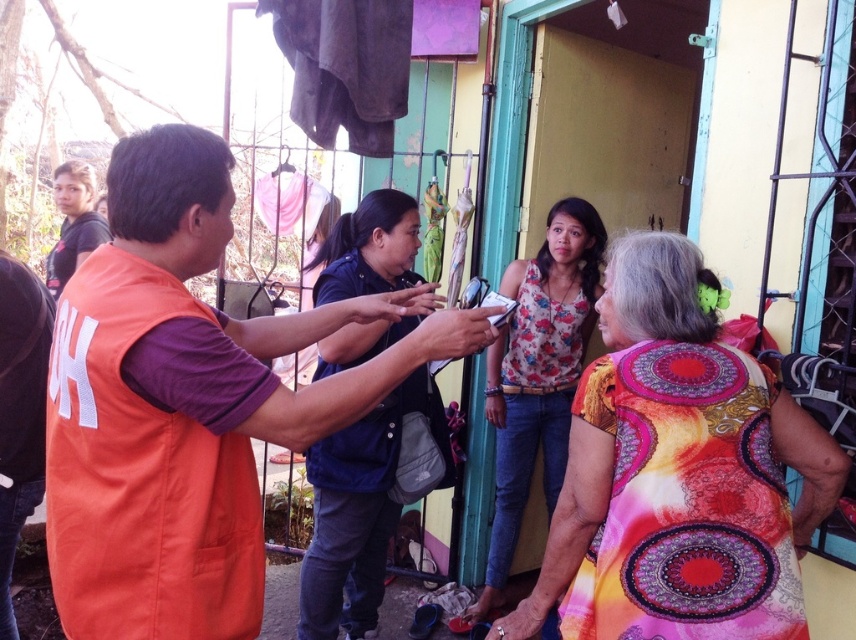
You are a painter who needs to paint a hand and a bracelet. You have brushes of different sizes. Which object requires a larger brush to paint accurately, the smooth skin hand at center or the smooth leather bracelet at lower center?

The smooth skin hand at center requires a larger brush because it is bigger than the smooth leather bracelet at lower center.

You are a photographer trying to capture a candid shot of the smooth skin hand at center and the floral fabric blouse at center. Which object should you focus on first if you want to ensure both are in focus?

The smooth skin hand at center is behind the floral fabric blouse at center, so you should focus on the floral fabric blouse at center first to ensure both are in focus.